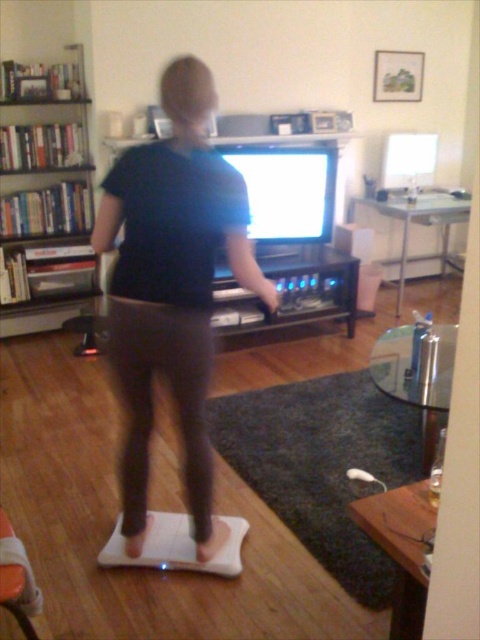
Question: Which point is closer to the camera?

Choices:
 (A) white rubber mat at lower center
 (B) wooden bookshelf at left
 (C) black matte shirt at center
 (D) black wood entertainment center at center

Answer: (C)

Question: Is white rubber mat at lower center positioned before black wood entertainment center at center?

Choices:
 (A) yes
 (B) no

Answer: (A)

Question: Among these objects, which one is farthest from the camera?

Choices:
 (A) black matte shirt at center
 (B) white rubber mat at lower center

Answer: (B)

Question: Which of the following is the farthest from the observer?

Choices:
 (A) black matte shirt at center
 (B) white rubber mat at lower center

Answer: (B)

Question: Is wooden bookshelf at left below black wood entertainment center at center?

Choices:
 (A) yes
 (B) no

Answer: (B)

Question: From the image, what is the correct spatial relationship of white rubber mat at lower center in relation to wooden bookshelf at left?

Choices:
 (A) left
 (B) right

Answer: (B)